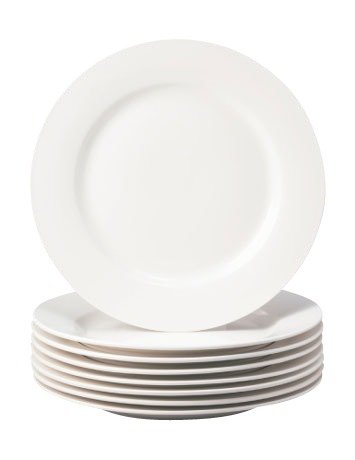
The height and width of the screenshot is (460, 355). Find the location of `stacked white plates`. stacked white plates is located at coordinates tap(197, 243), tap(188, 350), tap(190, 359), tap(186, 369), tap(193, 379), tap(190, 390), tap(193, 402), tap(189, 413).